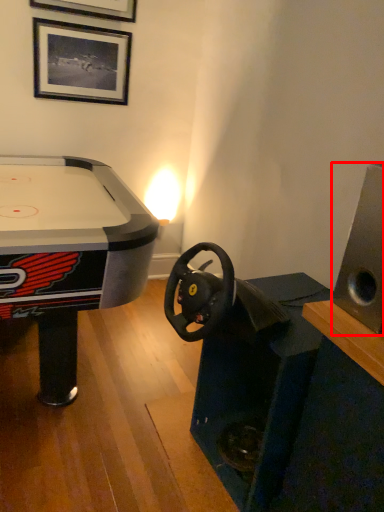
Question: Where is speaker (annotated by the red box) located in relation to picture frame in the image?

Choices:
 (A) left
 (B) right

Answer: (B)